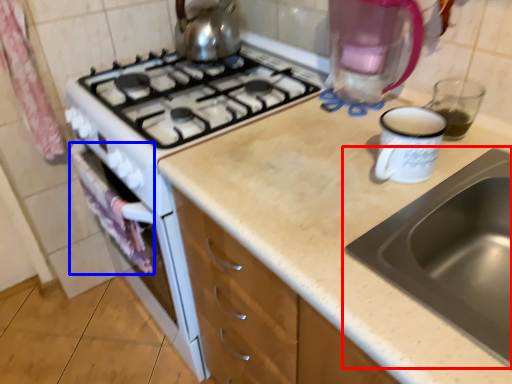
Question: Which object is closer to the camera taking this photo, sink (highlighted by a red box) or cloth (highlighted by a blue box)?

Choices:
 (A) sink
 (B) cloth

Answer: (A)